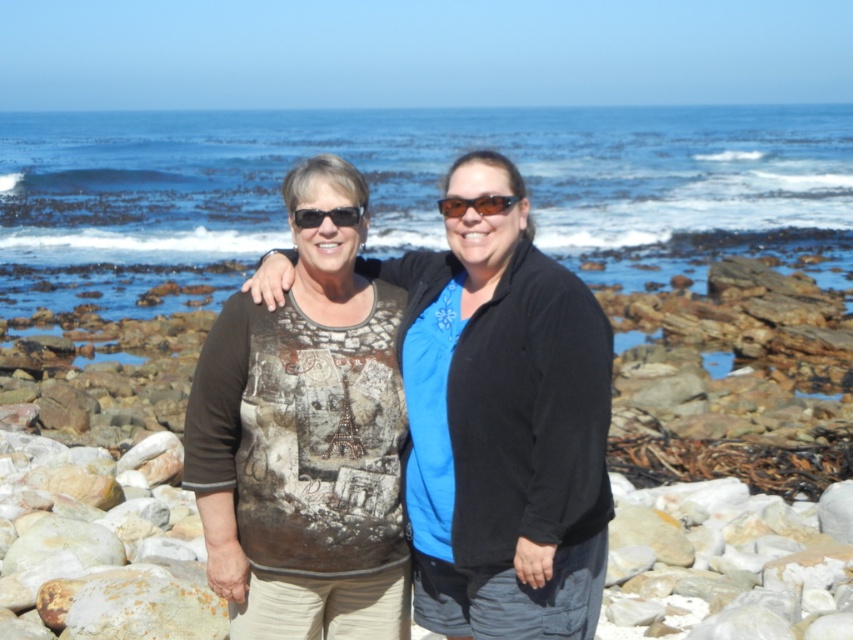
Is blue water at center wider than black plastic sunglasses at center?

Yes, blue water at center is wider than black plastic sunglasses at center.

Can you confirm if blue water at center is thinner than black plastic sunglasses at center?

No, blue water at center is not thinner than black plastic sunglasses at center.

Does point (396, 150) lie behind point (329, 216)?

Yes, it is behind point (329, 216).

I want to click on blue water at center, so (410, 189).

Who is positioned more to the left, printed cotton shirt at center or black plastic sunglasses at center?

black plastic sunglasses at center is more to the left.

Can you confirm if printed cotton shirt at center is positioned below black plastic sunglasses at center?

Yes.

Describe the element at coordinates (502, 422) in the screenshot. I see `printed cotton shirt at center` at that location.

You are a GUI agent. You are given a task and a screenshot of the screen. Output one action in this format:
    pyautogui.click(x=<x>, y=<y>)
    Task: Click on the printed cotton shirt at center
    
    Given the screenshot: What is the action you would take?
    pyautogui.click(x=502, y=422)

Which of these two, blue water at center or printed cotton shirt at center, stands taller?

blue water at center

Is point (96, 164) behind point (514, 192)?

Yes, it is.

The width and height of the screenshot is (853, 640). In order to click on blue water at center in this screenshot , I will do `click(410, 189)`.

Where is `blue water at center`? blue water at center is located at coordinates click(x=410, y=189).